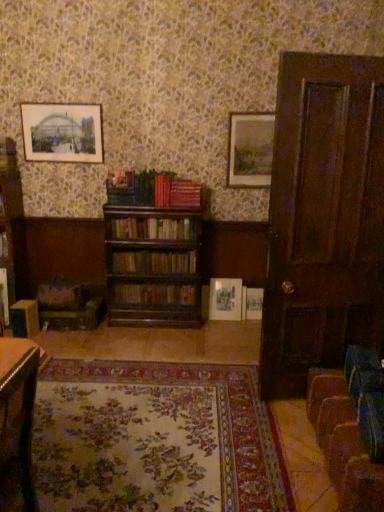
Identify the location of free point below wooden bookshelf at center, which is counted as the 3th book, starting from the top (from a real-world perspective). The height and width of the screenshot is (512, 384). (156, 284).